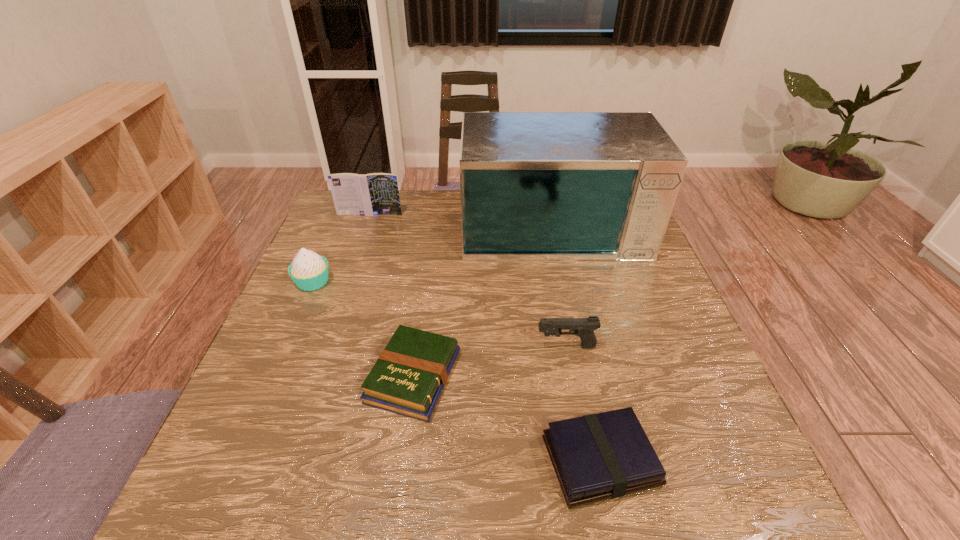
Locate an element on the screen. Image resolution: width=960 pixels, height=540 pixels. book that is the second closest to the fifth shortest object is located at coordinates (596, 457).

Point out which book is positioned as the second nearest to the rightmost book. Please provide its 2D coordinates. Your answer should be formatted as a tuple, i.e. [(x, y)], where the tuple contains the x and y coordinates of a point satisfying the conditions above.

[(372, 194)]

At what (x,y) coordinates should I click in order to perform the action: click on free spot that satisfies the following two spatial constraints: 1. on the front cover of the tallest book; 2. on the right side of the second book from right to left. Please return your answer as a coordinate pair (x, y). Looking at the image, I should click on (314, 376).

You are a GUI agent. You are given a task and a screenshot of the screen. Output one action in this format:
    pyautogui.click(x=<x>, y=<y>)
    Task: Click on the vacant space that satisfies the following two spatial constraints: 1. at the barrel of the pistol; 2. on the front side of the second book from right to left
    This screenshot has height=540, width=960.
    Given the screenshot: What is the action you would take?
    pyautogui.click(x=572, y=376)

In order to click on vacant area in the image that satisfies the following two spatial constraints: 1. at the barrel of the pistol; 2. on the left side of the rightmost book in this screenshot , I will do `click(588, 461)`.

At what (x,y) coordinates should I click in order to perform the action: click on vacant area in the image that satisfies the following two spatial constraints: 1. on the front cover of the farthest book; 2. on the right side of the rightmost book. Please return your answer as a coordinate pair (x, y). The image size is (960, 540). Looking at the image, I should click on (285, 461).

Identify the location of free location that satisfies the following two spatial constraints: 1. on the front-facing side of the microwave oven; 2. at the barrel of the fourth tallest object. (578, 346).